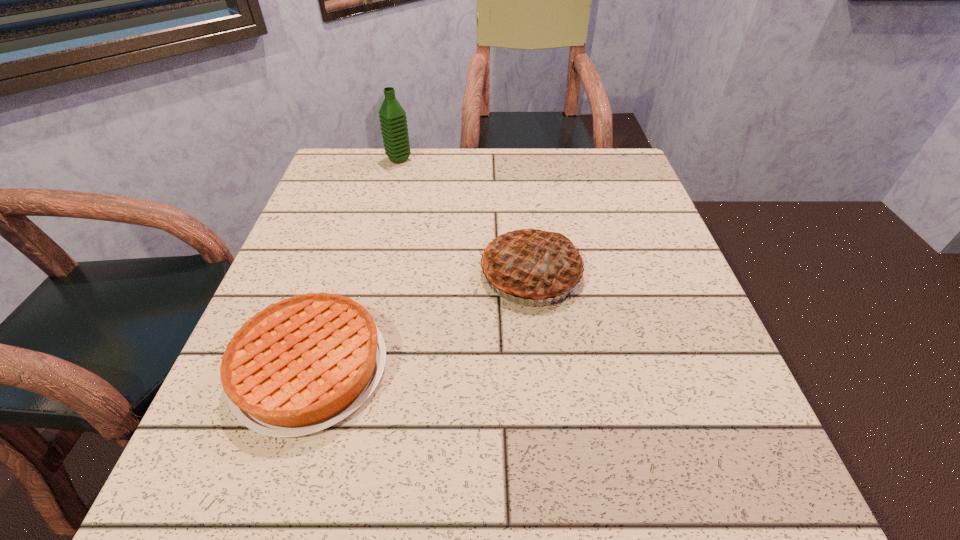
At what (x,y) coordinates should I click in order to perform the action: click on water bottle that is at the left edge. Please return your answer as a coordinate pair (x, y). Image resolution: width=960 pixels, height=540 pixels. Looking at the image, I should click on [x=392, y=116].

Find the location of a particular element. pie positioned at the left edge is located at coordinates (303, 364).

The width and height of the screenshot is (960, 540). I want to click on object that is at the far left corner, so click(x=392, y=116).

This screenshot has width=960, height=540. In the image, there is a desktop. In order to click on blank space at the far edge in this screenshot , I will do `click(491, 180)`.

Locate an element on the screen. free space at the near edge is located at coordinates (601, 464).

Identify the location of free region at the left edge. The height and width of the screenshot is (540, 960). (365, 205).

Where is `vacant area at the right edge`? This screenshot has height=540, width=960. vacant area at the right edge is located at coordinates (646, 371).

What are the coordinates of `vacant region at the far left corner` in the screenshot? It's located at (366, 147).

In the image, there is a desktop. Where is `vacant space at the far right corner`? This screenshot has height=540, width=960. vacant space at the far right corner is located at coordinates (581, 178).

This screenshot has height=540, width=960. I want to click on free space between the shorter pie and the second shortest object, so click(x=420, y=320).